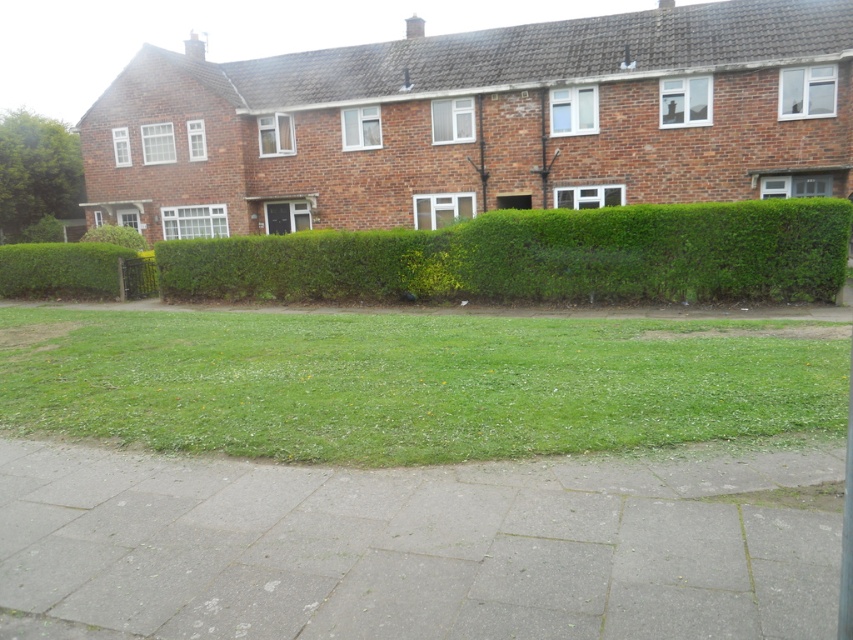
You are a gardener who needs to water the green grass at center and the green leafy bush at left. If your watering can holds 10 liters of water and you can carry it 10 meters before needing to refill, how many times will you need to refill your watering can to water both plants starting from the house entrance?

The distance between the green grass at center and the green leafy bush at left is 12.02 meters. Since the watering can can be carried 10 meters before needing a refill, you would need to refill it at least once to reach both plants. However, since you need to water both, you would first water one, then refill, and water the other. Therefore, you would need to refill your watering can at least twice.

You are standing on the sidewalk in front of the terraced houses. You notice two green leafy bushes. Which one, the green leafy bush at upper left or the green leafy bush at center, is wider?

The green leafy bush at upper left might be wider than the green leafy bush at center.

You are standing on the sidewalk in front of the terraced houses. You see the green leafy hedge at center and the green leafy bush at left. Which one is closer to the ground?

The green leafy hedge at center is located below the green leafy bush at left, so it is closer to the ground.